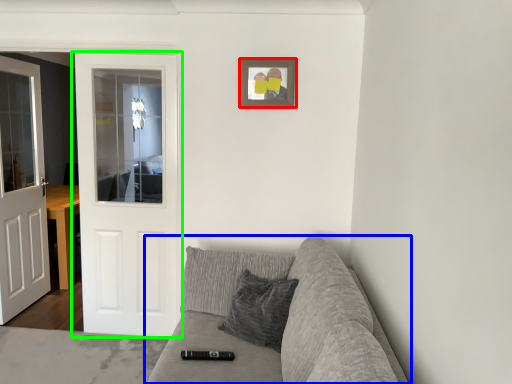
Question: Which object is the farthest from picture frame (highlighted by a red box)? Choose among these: studio couch (highlighted by a blue box) or door (highlighted by a green box).

Choices:
 (A) studio couch
 (B) door

Answer: (B)